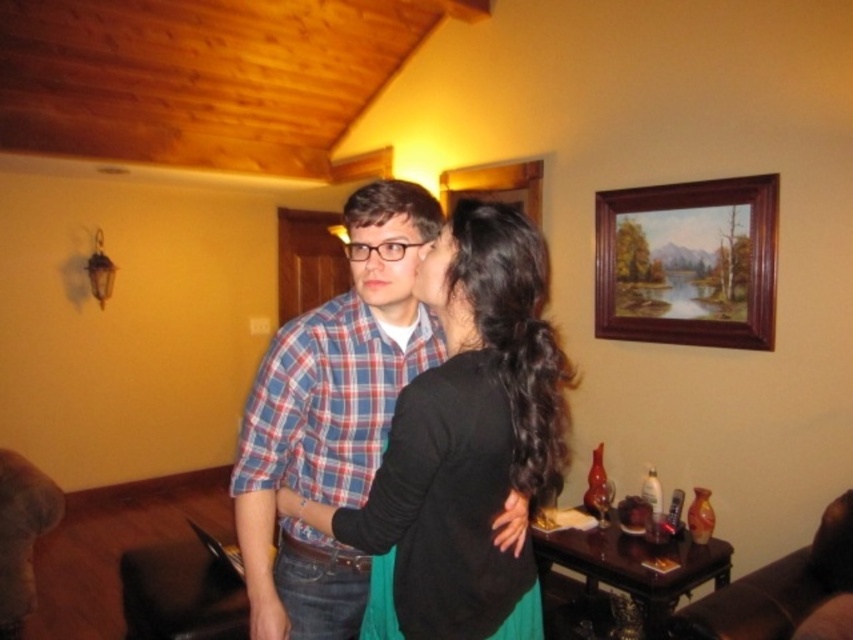
In the scene described, there are a plaid cotton shirt at center and a wooden picture frame at upper right. From the perspective of someone standing in the room, which object is positioned more to the left?

The plaid cotton shirt at center is positioned more to the left than the wooden picture frame at upper right.

From the picture: You are standing in the living room and want to hand a gift to the person wearing the plaid cotton shirt at center. Where should you approach to give them the gift?

The plaid cotton shirt at center is located at point 0.650 on the x axis and 0.390 on the y axis, so you should approach the coordinates of [332,416] to give the gift.

You are designing a layout for a catalog and need to place the plaid cotton shirt at center and the wooden picture frame at upper right. Given their sizes, which object should be placed closer to the edge of the page to ensure they both fit without overlapping?

The plaid cotton shirt at center occupies less space than the wooden picture frame at upper right, so the wooden picture frame at upper right should be placed closer to the edge of the page to accommodate its larger size and prevent overlapping with the plaid cotton shirt at center.